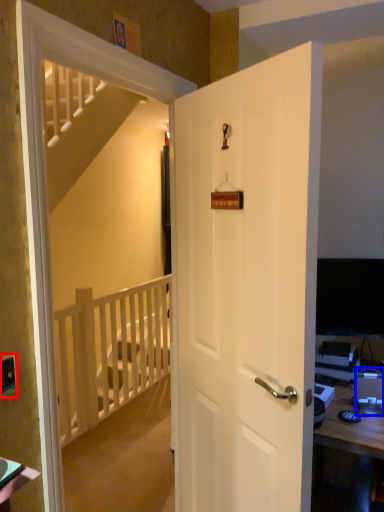
Question: Among these objects, which one is farthest to the camera, electric outlet (highlighted by a red box) or desktop computer (highlighted by a blue box)?

Choices:
 (A) electric outlet
 (B) desktop computer

Answer: (B)